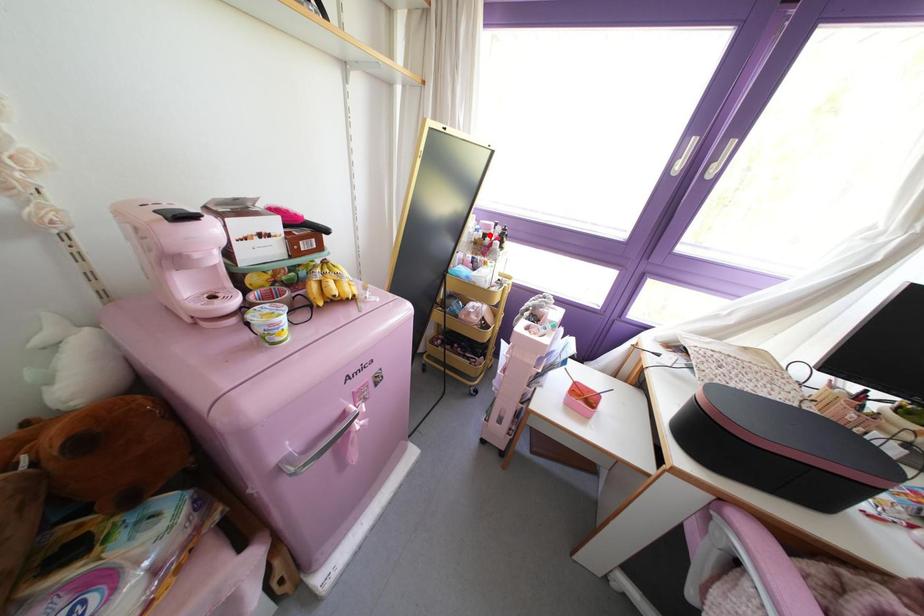
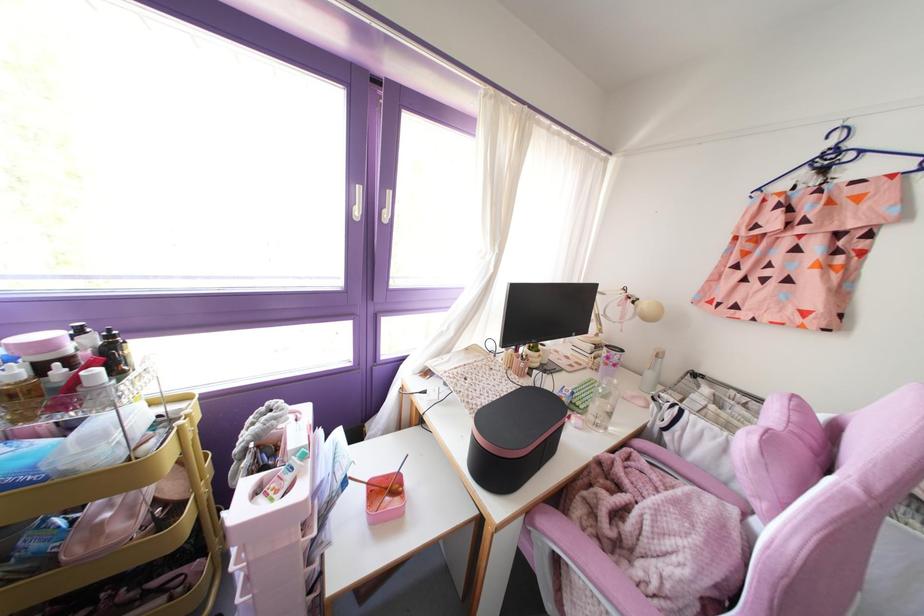
Find the pixel in the second image that matches the highlighted location in the first image.

(67, 360)